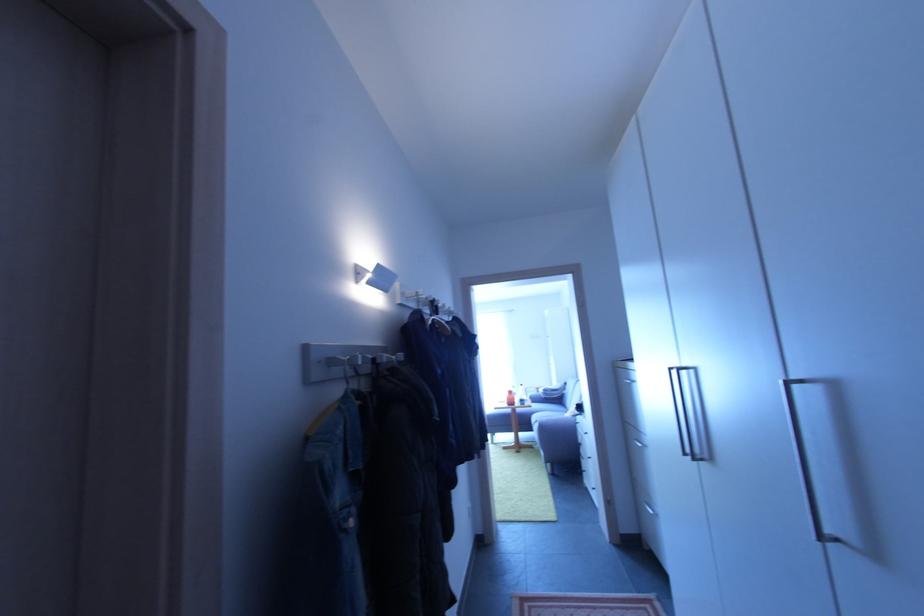
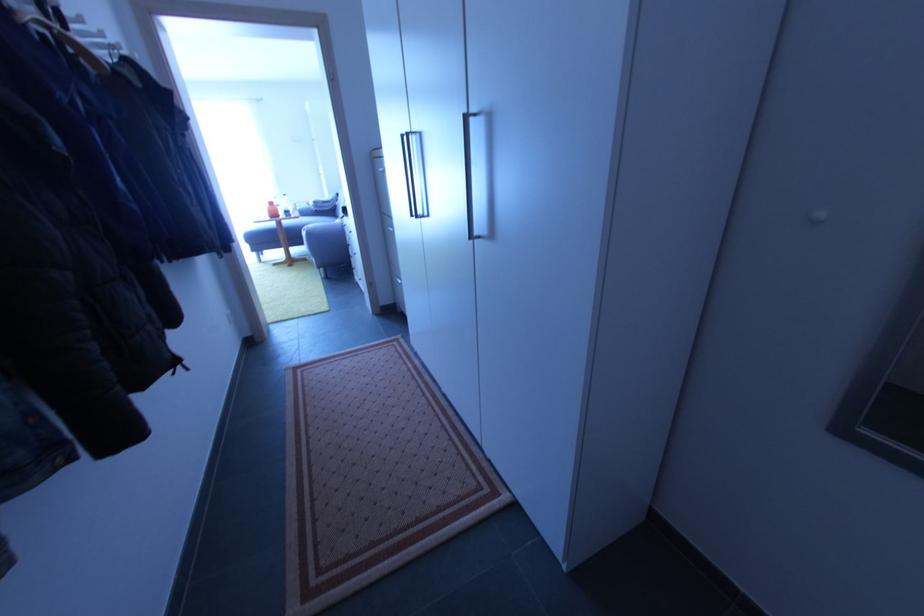
Find the pixel in the second image that matches point (515, 394) in the first image.

(275, 205)